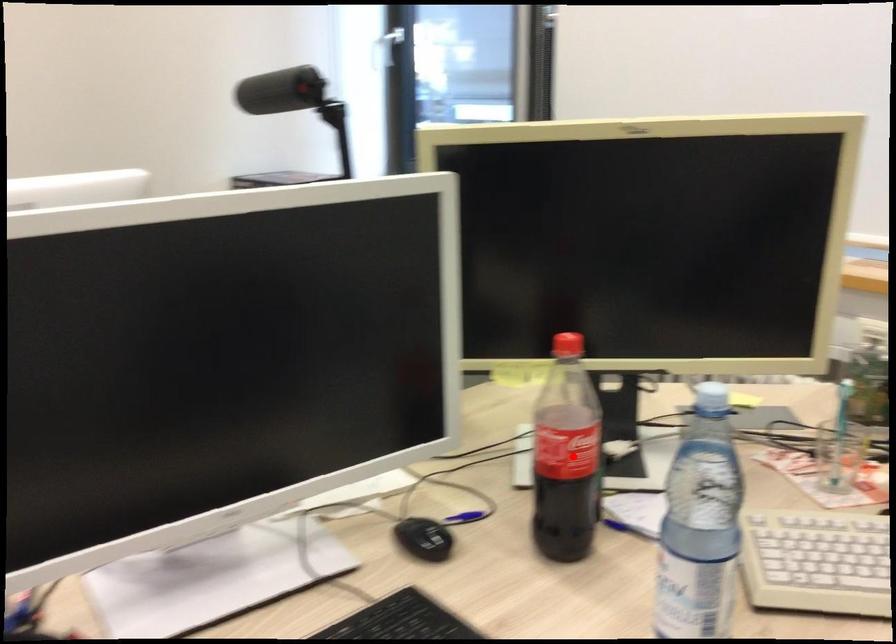
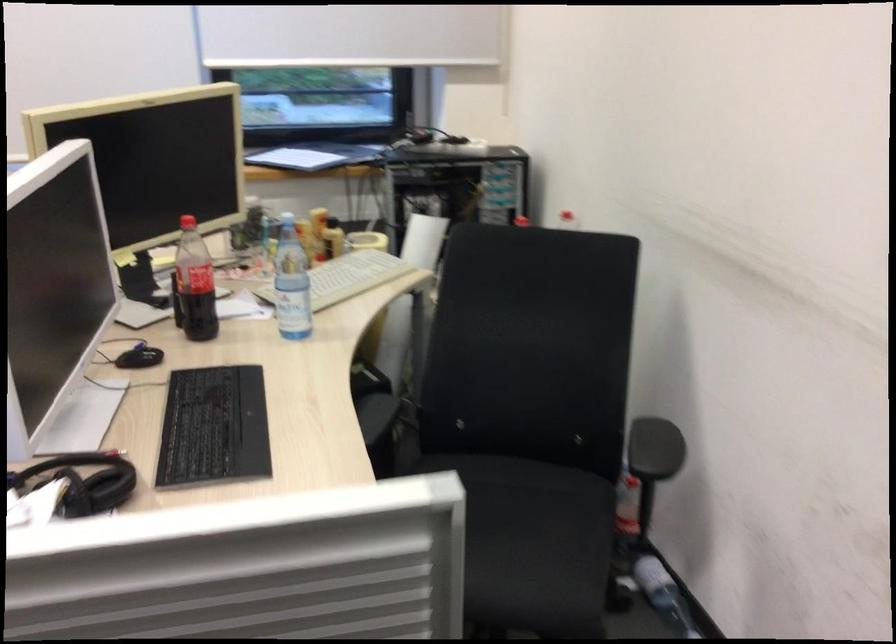
Where in the second image is the point corresponding to the highlighted location from the first image?

(194, 283)